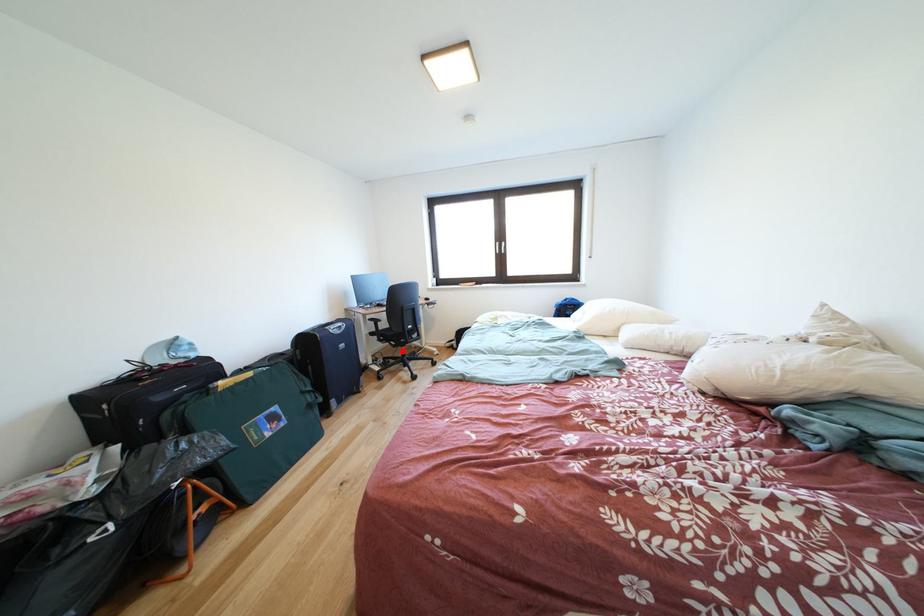
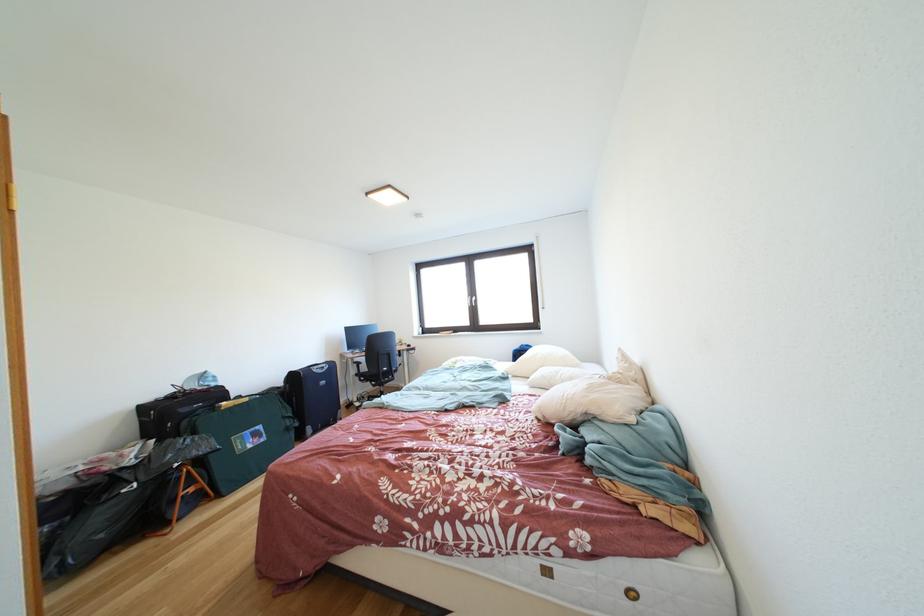
Question: I am providing you with two images of the same scene from different viewpoints. Given a red point in image1, look at the same physical point in image2. Is it:

Choices:
 (A) Closer to the viewpoint
 (B) Farther from the viewpoint

Answer: (B)